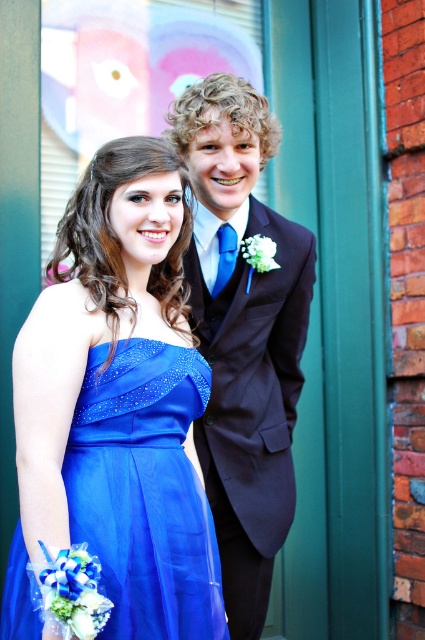
You are a photographer at a formal event. You need to decide which dress to focus on for a closeup shot. The blue satin dress at center and the shiny blue dress at center are both in the frame. Which dress should you choose if you want to capture more details due to its size?

The blue satin dress at center has a larger size compared to the shiny blue dress at center, so you should focus on the blue satin dress at center to capture more details.

You are a photographer at a prom event. You need to arrange the two people in the image so that the shiny dark suit at center and the shiny blue dress at center are visible in the photo. Based on their current positions, which one is on the right side?

The shiny dark suit at center is positioned on the right side of the shiny blue dress at center, so the shiny dark suit at center is on the right side.